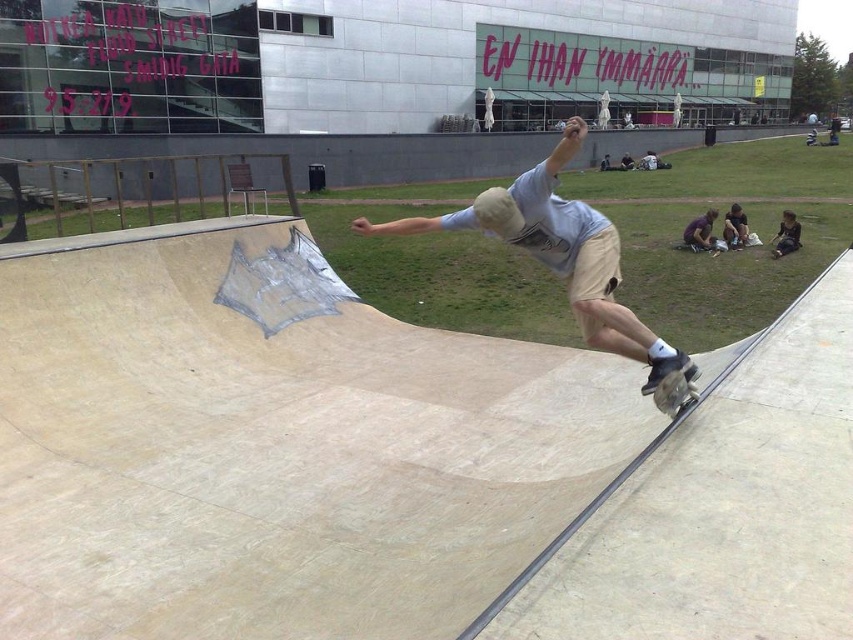
Question: Does light beige shorts at center have a lesser width compared to dark blue jeans at lower right?

Choices:
 (A) no
 (B) yes

Answer: (A)

Question: Which point is closer to the camera?

Choices:
 (A) (570, 216)
 (B) (793, 224)

Answer: (A)

Question: Which object appears farthest from the camera in this image?

Choices:
 (A) wooden textured skateboard at lower right
 (B) dark blue jeans at lower right
 (C) light beige shorts at center

Answer: (B)

Question: Estimate the real-world distances between objects in this image. Which object is closer to the dark blue jeans at lower right?

Choices:
 (A) light beige shorts at center
 (B) wooden textured skateboard at lower right

Answer: (A)

Question: Considering the relative positions of light beige shorts at center and dark blue jeans at lower right in the image provided, where is light beige shorts at center located with respect to dark blue jeans at lower right?

Choices:
 (A) right
 (B) left

Answer: (B)

Question: Is wooden textured skateboard at lower right to the left of dark blue jeans at lower right from the viewer's perspective?

Choices:
 (A) no
 (B) yes

Answer: (B)